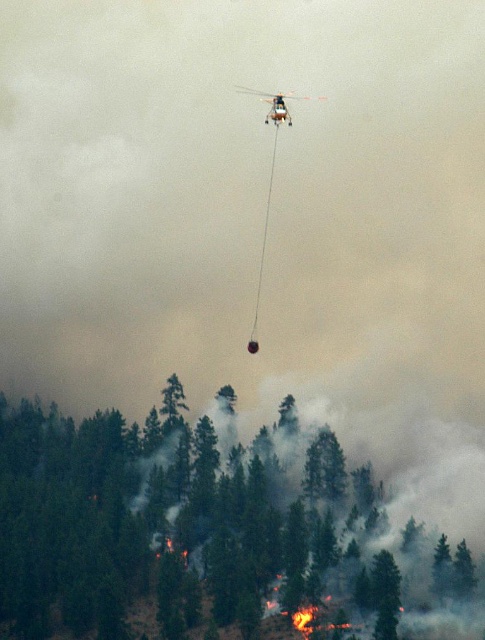
You are a pilot flying the metallic silver helicopter at upper center. You need to drop the fire retardant onto the green matte tree at lower center. Can you confirm if the helicopter is large enough to cover the entire tree with the retardant in one drop?

The green matte tree at lower center is bigger than the metallic silver helicopter at upper center, so the helicopter may not be large enough to cover the entire tree with one drop of retardant.

You are a firefighter pilot flying the helicopter. You need to drop the fire retardant from the helicopter to the green matte tree at lower center. The minimum safe distance for dropping is 200 meters. Can you drop it now?

The green matte tree at lower center is 229.02 meters away from the viewer, which is beyond the minimum safe distance of 200 meters. Therefore, you can safely drop the fire retardant now.